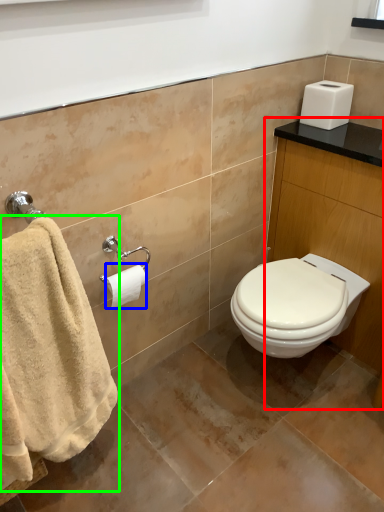
Question: Estimate the real-world distances between objects in this image. Which object is farther from vanity (highlighted by a red box), toilet paper (highlighted by a blue box) or towel (highlighted by a green box)?

Choices:
 (A) toilet paper
 (B) towel

Answer: (B)